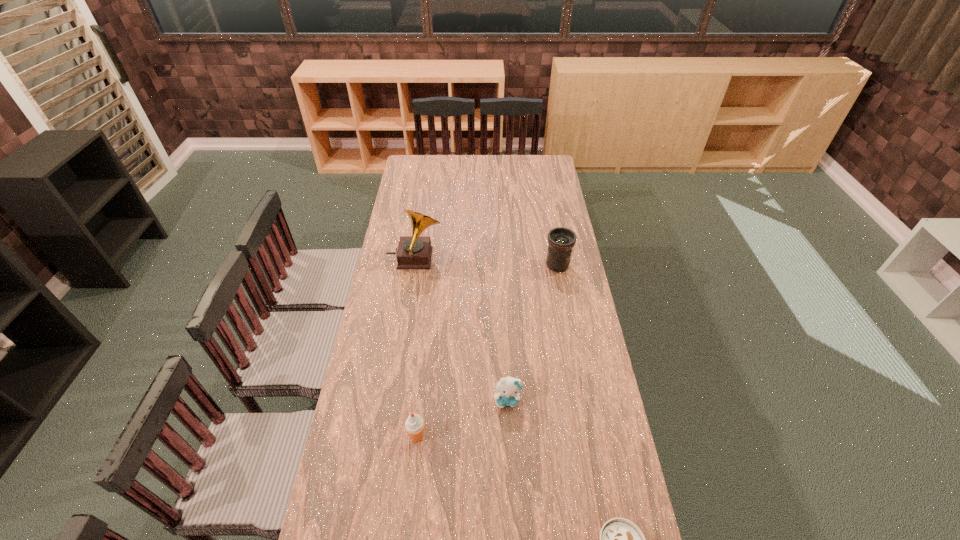
The height and width of the screenshot is (540, 960). Find the location of `phonograph record`. phonograph record is located at coordinates (414, 252).

Where is `telephoto lens`? telephoto lens is located at coordinates (561, 240).

Where is `the third shortest object`? Image resolution: width=960 pixels, height=540 pixels. the third shortest object is located at coordinates (414, 426).

You are a GUI agent. You are given a task and a screenshot of the screen. Output one action in this format:
    pyautogui.click(x=<x>, y=<y>)
    Task: Click on the icecream
    This screenshot has width=960, height=540.
    Given the screenshot: What is the action you would take?
    pyautogui.click(x=414, y=426)

Find the location of a particular element. Image resolution: width=960 pixels, height=540 pixels. the third farthest object is located at coordinates (x=509, y=388).

Locate an element on the screen. the second shortest object is located at coordinates (509, 388).

Locate an element on the screen. Image resolution: width=960 pixels, height=540 pixels. blank space located 0.330m from the horn of the phonograph record is located at coordinates (516, 259).

Where is `vacant space located 0.150m on the front of the telephoto lens`? The width and height of the screenshot is (960, 540). vacant space located 0.150m on the front of the telephoto lens is located at coordinates (564, 300).

You are a GUI agent. You are given a task and a screenshot of the screen. Output one action in this format:
    pyautogui.click(x=<x>, y=<y>)
    Task: Click on the free spot located on the right of the icecream
    The width and height of the screenshot is (960, 540).
    Given the screenshot: What is the action you would take?
    pyautogui.click(x=528, y=436)

Where is `vacant space located 0.220m on the face of the kitten`? vacant space located 0.220m on the face of the kitten is located at coordinates (512, 478).